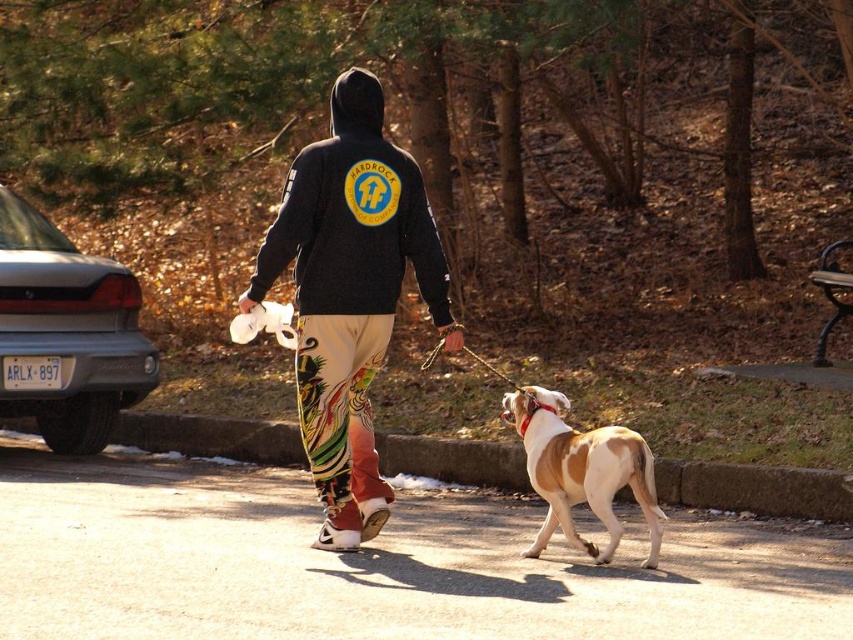
Based on the photo, is black matte hoodie at center positioned in front of brown and white fur at center?

No, black matte hoodie at center is behind brown and white fur at center.

Which is below, black matte hoodie at center or brown and white fur at center?

brown and white fur at center

Is point (337, 147) more distant than point (581, 444)?

Yes, point (337, 147) is behind point (581, 444).

Where is `black matte hoodie at center`? This screenshot has width=853, height=640. black matte hoodie at center is located at coordinates (350, 294).